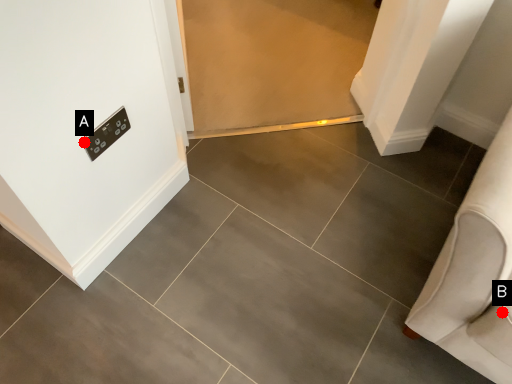
Question: Two points are circled on the image, labeled by A and B beside each circle. Which point is closer to the camera?

Choices:
 (A) A is closer
 (B) B is closer

Answer: (B)